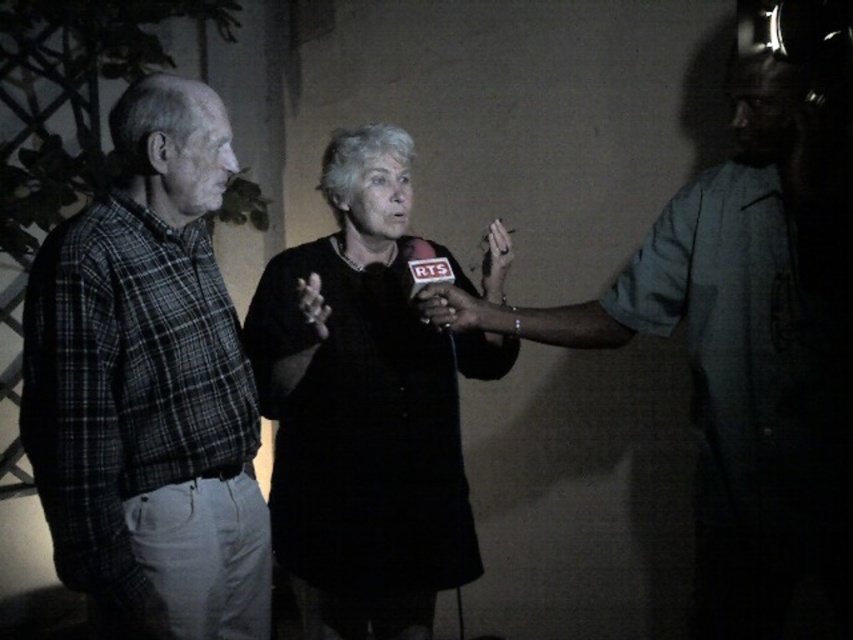
This screenshot has height=640, width=853. What do you see at coordinates (148, 387) in the screenshot?
I see `plaid shirt at left` at bounding box center [148, 387].

Find the location of a particular element. plaid shirt at left is located at coordinates (148, 387).

Is point (138, 572) closer to viewer compared to point (318, 502)?

Yes, point (138, 572) is closer to viewer.

What do you see at coordinates (148, 387) in the screenshot? I see `plaid shirt at left` at bounding box center [148, 387].

Is point (45, 449) positioned before point (343, 131)?

That is True.

I want to click on plaid shirt at left, so click(148, 387).

Which of these two, matte gray shirt at right or black matte microphone at center, stands shorter?

black matte microphone at center is shorter.

Is matte gray shirt at right thinner than black matte microphone at center?

Incorrect, matte gray shirt at right's width is not less than black matte microphone at center's.

At what (x,y) coordinates should I click in order to perform the action: click on matte gray shirt at right. Please return your answer as a coordinate pair (x, y). The height and width of the screenshot is (640, 853). Looking at the image, I should click on (753, 339).